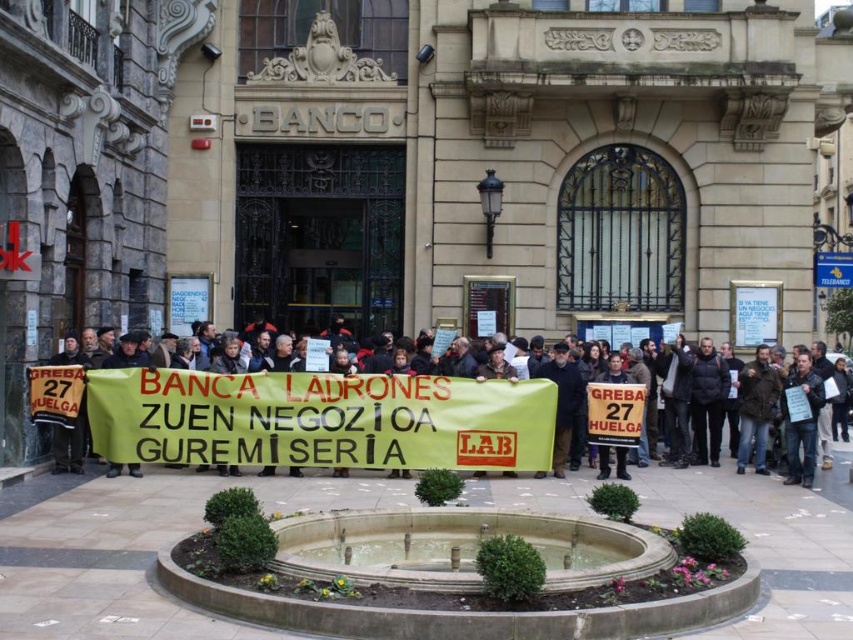
Question: Is dark gray jacket at center behind white paper sign at center?

Choices:
 (A) no
 (B) yes

Answer: (A)

Question: Among these objects, which one is farthest from the camera?

Choices:
 (A) white paper sign at center
 (B) dark gray jacket at center

Answer: (A)

Question: Which of the following is the farthest from the observer?

Choices:
 (A) dark gray jacket at center
 (B) white paper sign at center

Answer: (B)

Question: Among these points, which one is farthest from the camera?

Choices:
 (A) (798, 429)
 (B) (454, 392)

Answer: (A)

Question: Is dark gray jacket at center to the right of white paper sign at center from the viewer's perspective?

Choices:
 (A) yes
 (B) no

Answer: (B)

Question: Is dark gray jacket at center positioned before white paper sign at center?

Choices:
 (A) yes
 (B) no

Answer: (A)